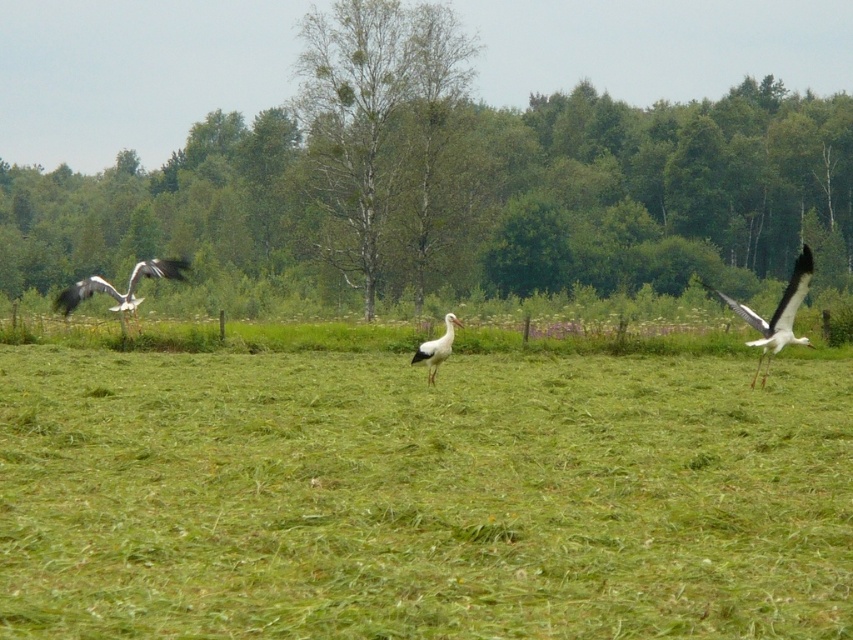
Question: Which point is closer to the camera taking this photo?

Choices:
 (A) (431, 381)
 (B) (143, 262)
 (C) (352, 32)

Answer: (A)

Question: Considering the real-world distances, which object is farthest from the white matte stork at right?

Choices:
 (A) green leafy tree at center
 (B) green bark tree at center

Answer: (A)

Question: Can you confirm if white matte stork at right is positioned above white matte stork at center?

Choices:
 (A) yes
 (B) no

Answer: (A)

Question: Is the position of green leafy tree at center less distant than that of white matte stork at center?

Choices:
 (A) yes
 (B) no

Answer: (B)

Question: Which object appears farthest from the camera in this image?

Choices:
 (A) green leafy tree at center
 (B) green bark tree at center
 (C) white feathered stork at left
 (D) white matte stork at right

Answer: (A)

Question: Is green bark tree at center to the left of white feathered stork at left from the viewer's perspective?

Choices:
 (A) no
 (B) yes

Answer: (A)